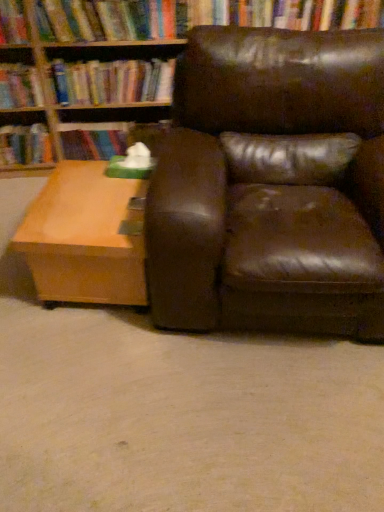
You are a GUI agent. You are given a task and a screenshot of the screen. Output one action in this format:
    pyautogui.click(x=<x>, y=<y>)
    Task: Click on the empty space that is ontop of light brown wood coffee table at lower left
    
    Given the screenshot: What is the action you would take?
    pyautogui.click(x=93, y=201)